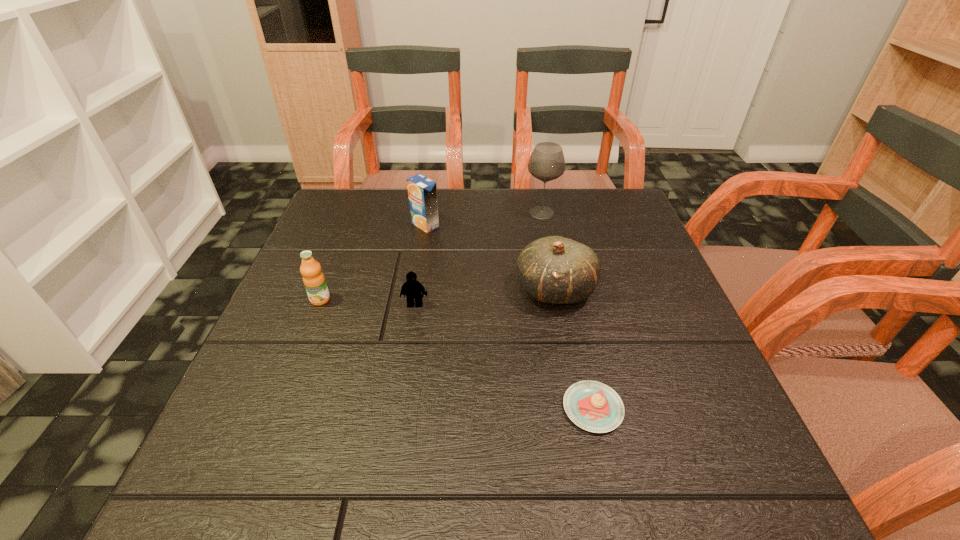
I want to click on vacant region at the right edge, so click(x=653, y=293).

In the image, there is a desktop. Find the location of `blank space at the far right corner`. blank space at the far right corner is located at coordinates (587, 210).

Locate an element on the screen. The width and height of the screenshot is (960, 540). vacant area that lies between the right orange juice and the gourd is located at coordinates (490, 257).

Locate an element on the screen. This screenshot has height=540, width=960. vacant space that's between the tallest object and the farther orange juice is located at coordinates (484, 219).

This screenshot has height=540, width=960. I want to click on free point between the farther orange juice and the gourd, so click(x=490, y=257).

The image size is (960, 540). Identify the location of vacant point located between the tallest object and the second shortest object. (478, 259).

Locate an element on the screen. The height and width of the screenshot is (540, 960). vacant space that's between the pastry and the left orange juice is located at coordinates (457, 354).

Identify the location of vacant space that's between the leftmost object and the fifth tallest object. The height and width of the screenshot is (540, 960). (368, 302).

Where is `free spot between the gourd and the left orange juice`? free spot between the gourd and the left orange juice is located at coordinates coord(438,294).

Find the location of `free spot between the tallest object and the nearest object`. free spot between the tallest object and the nearest object is located at coordinates (567, 310).